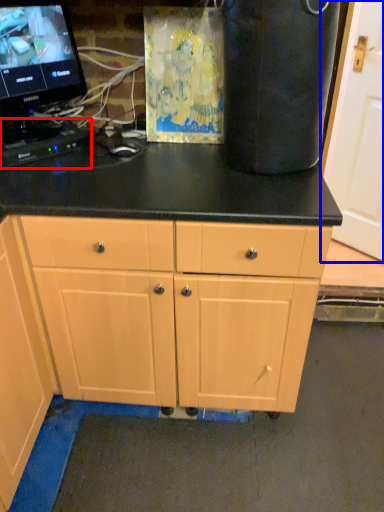
Question: Which point is further to the camera, computer keyboard (highlighted by a red box) or door (highlighted by a blue box)?

Choices:
 (A) computer keyboard
 (B) door

Answer: (B)